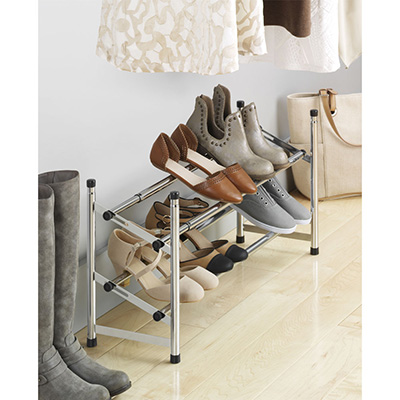
The width and height of the screenshot is (400, 400). Identify the location of legs of shoe rack. (238, 228), (314, 241), (179, 350), (88, 330).